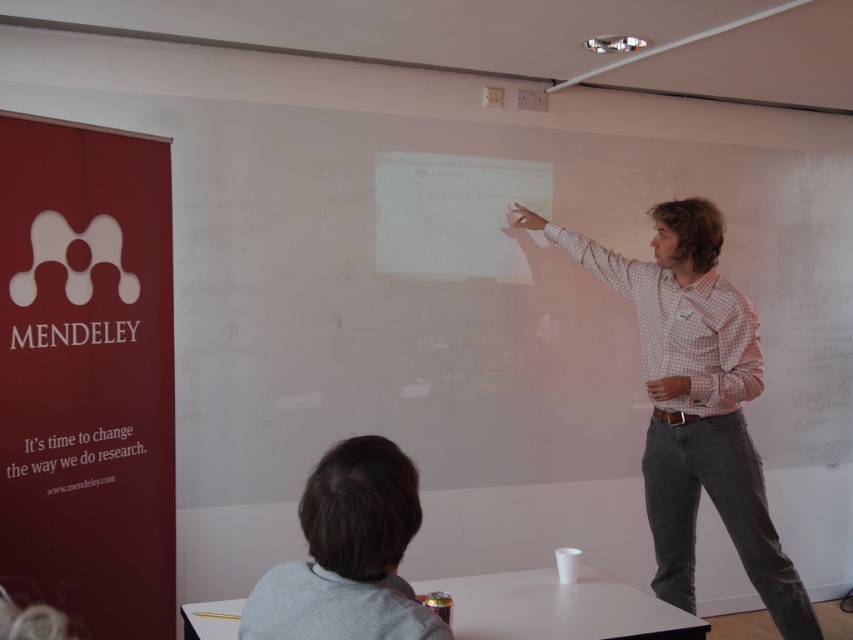
You are sitting in the conference room and want to know which point is closer to you. The points are point (643, 371) and point (360, 554). Can you tell me?

Point (643, 371) is further to the viewer than point (360, 554), so the closer point to you is point (360, 554).